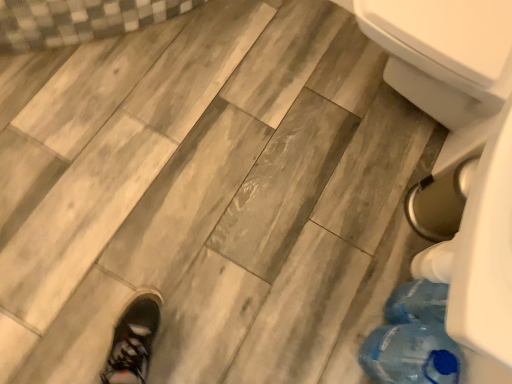
The width and height of the screenshot is (512, 384). Describe the element at coordinates (411, 355) in the screenshot. I see `transparent plastic bottle at lower right` at that location.

This screenshot has width=512, height=384. Find the location of `transparent plastic bottle at lower right`. transparent plastic bottle at lower right is located at coordinates (411, 355).

What is the approximate width of transparent plastic bottle at lower right?

transparent plastic bottle at lower right is 17.50 centimeters in width.

Measure the distance between point (394, 351) and camera.

1.06 meters.

What do you see at coordinates (446, 62) in the screenshot? I see `white plastic bidet at lower right` at bounding box center [446, 62].

Identify the location of white plastic bidet at lower right. (446, 62).

Locate an element on the screen. The image size is (512, 384). transparent plastic bottle at lower right is located at coordinates (411, 355).

Considering the positions of objects transparent plastic bottle at lower right and white plastic bidet at lower right in the image provided, who is more to the left, transparent plastic bottle at lower right or white plastic bidet at lower right?

Positioned to the left is transparent plastic bottle at lower right.

Relative to white plastic bidet at lower right, is transparent plastic bottle at lower right in front or behind?

In the image, transparent plastic bottle at lower right appears in front of white plastic bidet at lower right.

Does point (436, 334) come in front of point (460, 12)?

Yes, it is in front of point (460, 12).

From the image's perspective, is transparent plastic bottle at lower right over white plastic bidet at lower right?

No, from the image's perspective, transparent plastic bottle at lower right is not over white plastic bidet at lower right.

From a real-world perspective, which is physically above, transparent plastic bottle at lower right or white plastic bidet at lower right?

From a 3D spatial view, white plastic bidet at lower right is above.

Which of these two, transparent plastic bottle at lower right or white plastic bidet at lower right, is wider?

white plastic bidet at lower right is wider.

Considering the relative sizes of transparent plastic bottle at lower right and white plastic bidet at lower right in the image provided, is transparent plastic bottle at lower right taller than white plastic bidet at lower right?

No, transparent plastic bottle at lower right is not taller than white plastic bidet at lower right.

Who is bigger, transparent plastic bottle at lower right or white plastic bidet at lower right?

white plastic bidet at lower right is bigger.

Is transparent plastic bottle at lower right located outside white plastic bidet at lower right?

Indeed, transparent plastic bottle at lower right is completely outside white plastic bidet at lower right.

Is there a large distance between transparent plastic bottle at lower right and white plastic bidet at lower right?

No, transparent plastic bottle at lower right is not far from white plastic bidet at lower right.

Is transparent plastic bottle at lower right facing towards white plastic bidet at lower right?

No.

How many degrees apart are the facing directions of transparent plastic bottle at lower right and white plastic bidet at lower right?

1.95 degrees separate the facing orientations of transparent plastic bottle at lower right and white plastic bidet at lower right.

This screenshot has width=512, height=384. I want to click on bidet above the transparent plastic bottle at lower right (from the image's perspective), so click(x=446, y=62).

Can you confirm if white plastic bidet at lower right is positioned to the left of transparent plastic bottle at lower right?

No, white plastic bidet at lower right is not to the left of transparent plastic bottle at lower right.

Which is in front, white plastic bidet at lower right or transparent plastic bottle at lower right?

transparent plastic bottle at lower right is closer to the camera.

Which is closer, [497,46] or [442,364]?

The point [442,364] is more forward.

From the image's perspective, is white plastic bidet at lower right on top of transparent plastic bottle at lower right?

Yes, from the image's perspective, white plastic bidet at lower right is over transparent plastic bottle at lower right.

From a real-world perspective, is white plastic bidet at lower right physically located above or below transparent plastic bottle at lower right?

Clearly, from a real-world perspective, white plastic bidet at lower right is above transparent plastic bottle at lower right.

Looking at their sizes, would you say white plastic bidet at lower right is wider or thinner than transparent plastic bottle at lower right?

Considering their sizes, white plastic bidet at lower right looks broader than transparent plastic bottle at lower right.

Does white plastic bidet at lower right have a greater height compared to transparent plastic bottle at lower right?

Yes.

Based on their sizes in the image, would you say white plastic bidet at lower right is bigger or smaller than transparent plastic bottle at lower right?

white plastic bidet at lower right is bigger than transparent plastic bottle at lower right.

Would you say transparent plastic bottle at lower right is part of white plastic bidet at lower right's contents?

No.

Are white plastic bidet at lower right and transparent plastic bottle at lower right making contact?

No, white plastic bidet at lower right is not with transparent plastic bottle at lower right.

Is transparent plastic bottle at lower right at the back of white plastic bidet at lower right?

No, white plastic bidet at lower right is not facing away from transparent plastic bottle at lower right.

How distant is white plastic bidet at lower right from transparent plastic bottle at lower right?

The distance of white plastic bidet at lower right from transparent plastic bottle at lower right is 26.64 inches.

The height and width of the screenshot is (384, 512). Identify the location of bidet above the transparent plastic bottle at lower right (from a real-world perspective). [x=446, y=62].

I want to click on bidet that is above the transparent plastic bottle at lower right (from the image's perspective), so click(x=446, y=62).

You are a GUI agent. You are given a task and a screenshot of the screen. Output one action in this format:
    pyautogui.click(x=<x>, y=<y>)
    Task: Click on the bidet behind the transparent plastic bottle at lower right
    
    Given the screenshot: What is the action you would take?
    pyautogui.click(x=446, y=62)